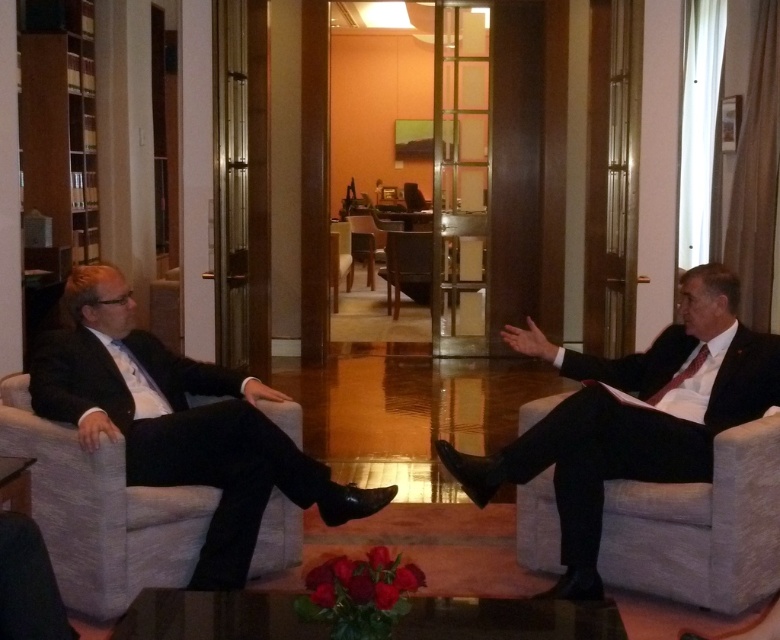
Question: Which object is positioned farthest from the wooden chair at center?

Choices:
 (A) matte black suit at left
 (B) wooden textured chair at center
 (C) matte black suit at right
 (D) dark gray fabric couch at left

Answer: (D)

Question: Estimate the real-world distances between objects in this image. Which object is farther from the dark gray fabric couch at left?

Choices:
 (A) matte black suit at left
 (B) matte black suit at right

Answer: (B)

Question: Which of the following is the closest to the observer?

Choices:
 (A) (371, 260)
 (B) (371, 513)
 (C) (388, 282)
 (D) (750, 410)

Answer: (B)

Question: Is matte black suit at left further to the viewer compared to matte black suit at right?

Choices:
 (A) no
 (B) yes

Answer: (A)

Question: Is matte black suit at right wider than wooden chair at center?

Choices:
 (A) no
 (B) yes

Answer: (B)

Question: Does matte black suit at left appear over matte black suit at right?

Choices:
 (A) no
 (B) yes

Answer: (A)